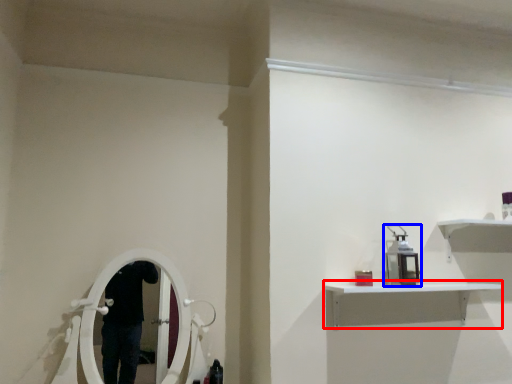
Question: Which object appears farthest to the camera in this image, shelf (highlighted by a red box) or equipment (highlighted by a blue box)?

Choices:
 (A) shelf
 (B) equipment

Answer: (B)